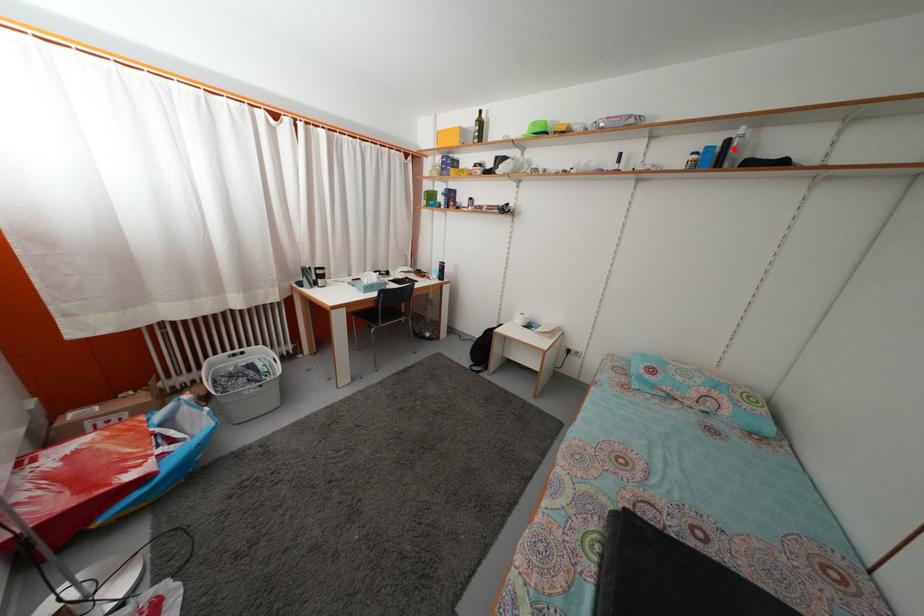
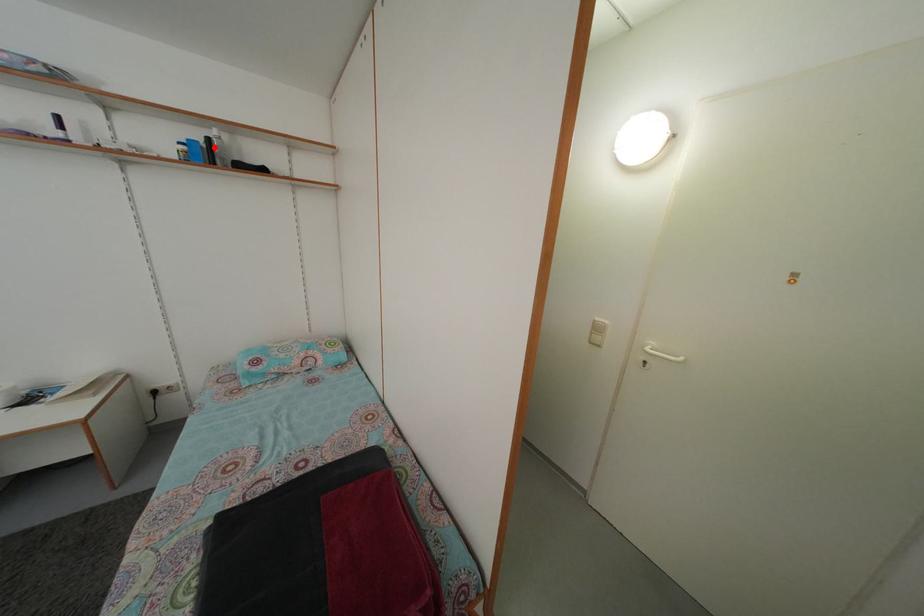
I am providing you with two images of the same scene from different viewpoints. A red point is marked on the first image and another point is marked on the second image. Is the red point in image1 aligned with the point shown in image2?

Yes